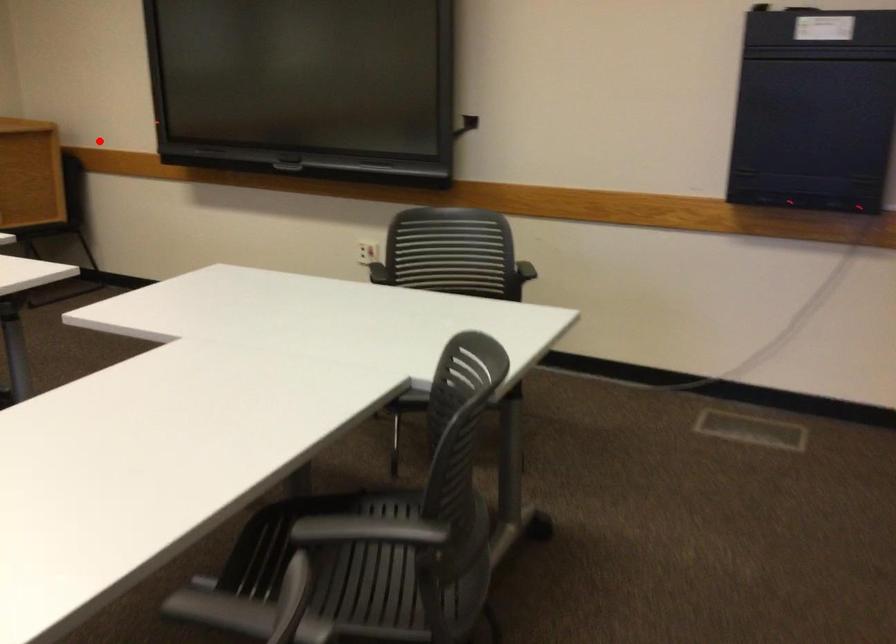
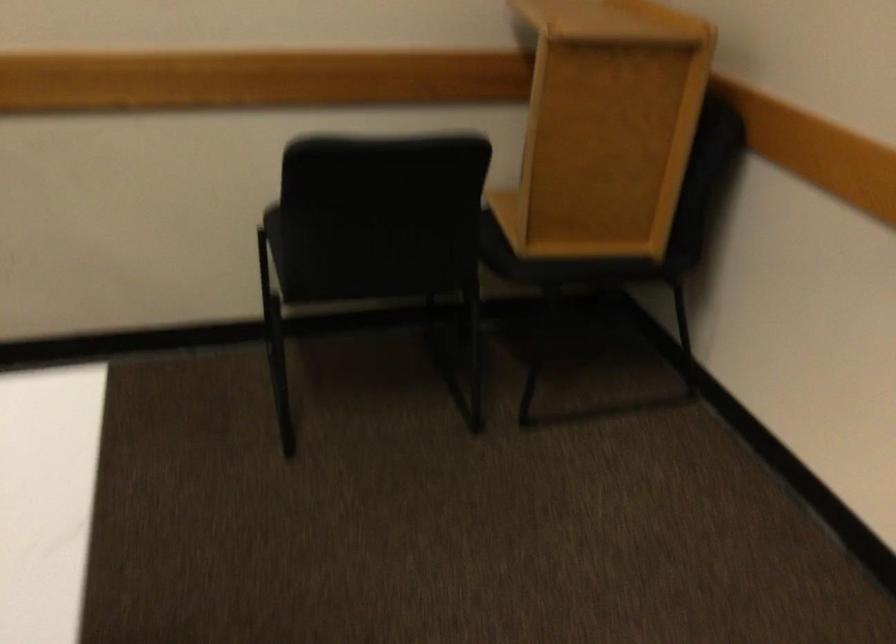
In the second image, find the point that corresponds to the highlighted location in the first image.

(605, 127)